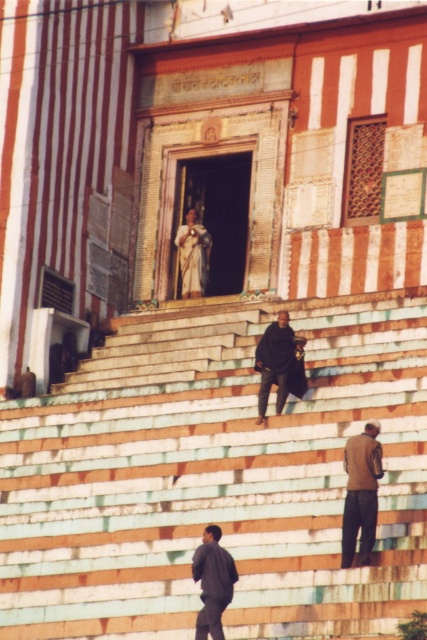
You are a photographer setting up a tripod to capture the entrance of the temple. You notice the dark gray fabric pants at lower center and the dark matte coat at center. Which object should you focus on to ensure they both fit in the frame without moving the tripod?

You should focus on the dark matte coat at center because it is narrower than the dark gray fabric pants at lower center, so centering the dark matte coat at center will allow both objects to fit within the frame.

You are a tourist visiting this temple and want to take a photo of both the multicolored stone steps at center and the white fabric statue at center. Which one should you focus on first if you want to ensure both are in the frame?

You should focus on the multicolored stone steps at center first because it is larger in size than the white fabric statue at center, allowing both to fit within the frame more easily.